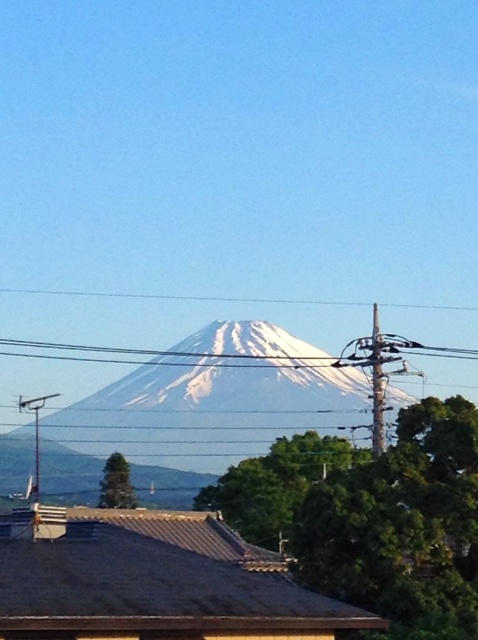
Is the position of white snow-covered mountain at center less distant than that of black wire at center?

Yes.

Between white snow-covered mountain at center and black wire at center, which one is positioned higher?

black wire at center

Who is more distant from viewer, (240, 413) or (171, 348)?

Positioned behind is point (171, 348).

Locate an element on the screen. This screenshot has height=640, width=478. white snow-covered mountain at center is located at coordinates (217, 397).